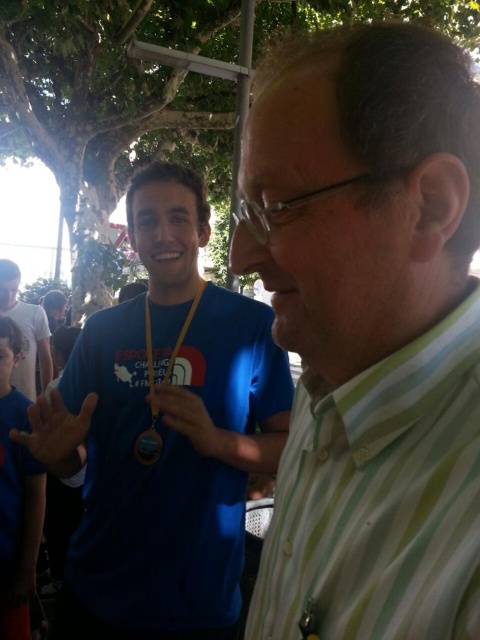
You are a photographer standing at the center of the scene. You want to take a photo of the white cotton shirt at upper left. Which direction should you move to get the shirt into the frame?

The white cotton shirt at upper left is located at point 0.520 on the x axis and 0.054 on the y axis. Since you are at the center, you should move to the left along the x axis and upwards along the y axis to position yourself for the shot.

You are a photographer trying to capture a closeup of both the smooth skin hand at center and the yellow fabric lanyard at center in the scene. Since you want both objects to appear the same size in the photo, which object should you move closer to the camera?

The smooth skin hand at center is bigger than the yellow fabric lanyard at center, so you should move the yellow fabric lanyard at center closer to the camera to make them appear the same size.